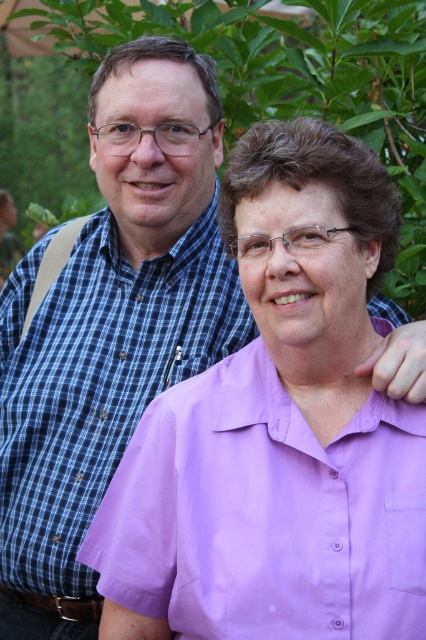
Can you confirm if lavender smooth shirt at center is bigger than purple cotton shirt at center?

No.

Is point (408, 545) positioned after point (163, 381)?

No, (408, 545) is closer to viewer.

Which is in front, point (115, 477) or point (65, 380)?

Point (115, 477)

Find the location of a particular element. The width and height of the screenshot is (426, 640). lavender smooth shirt at center is located at coordinates (265, 515).